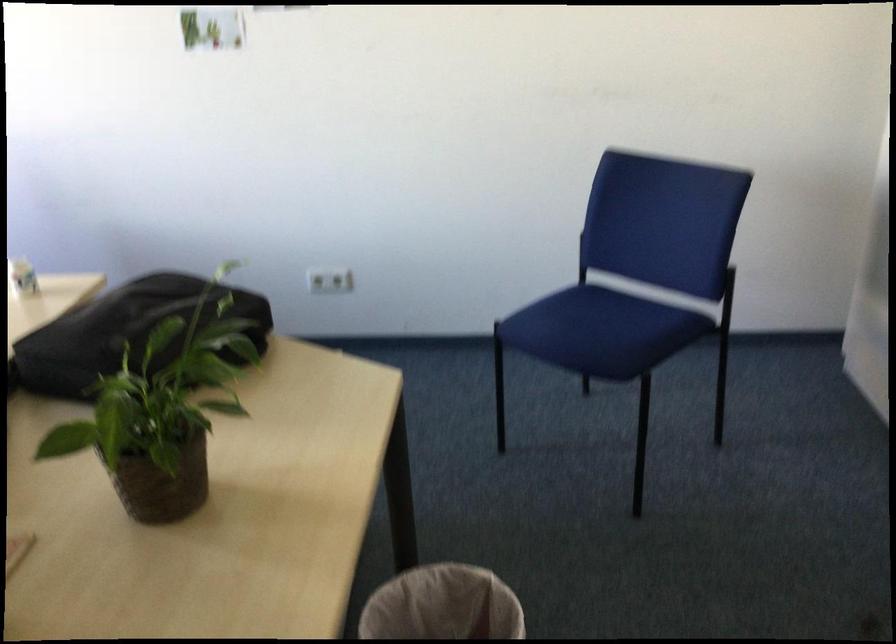
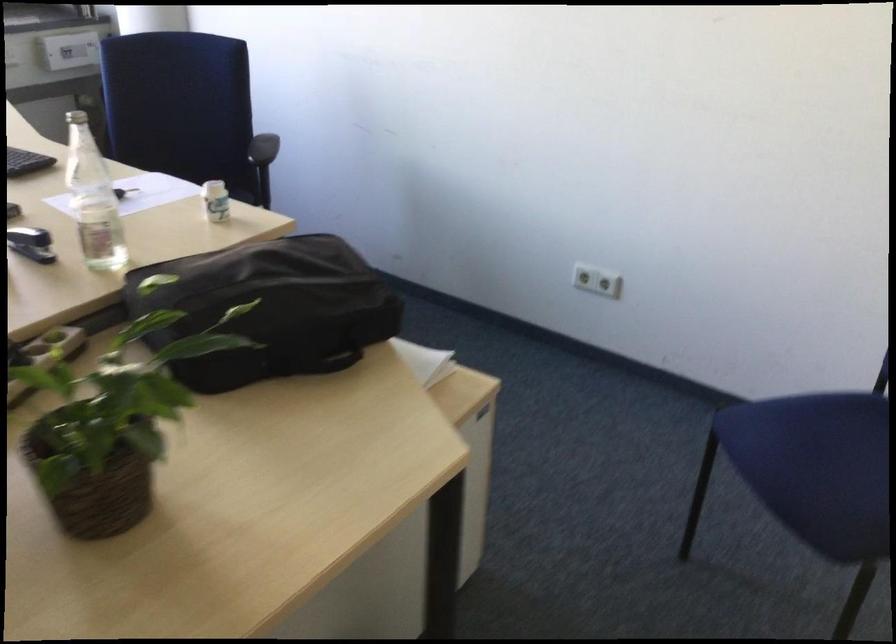
Question: The camera is either moving clockwise (left) or counter-clockwise (right) around the object. The first image is from the beginning of the video and the second image is from the end. Is the camera moving left or right when shooting the video?

Choices:
 (A) Left
 (B) Right

Answer: (B)